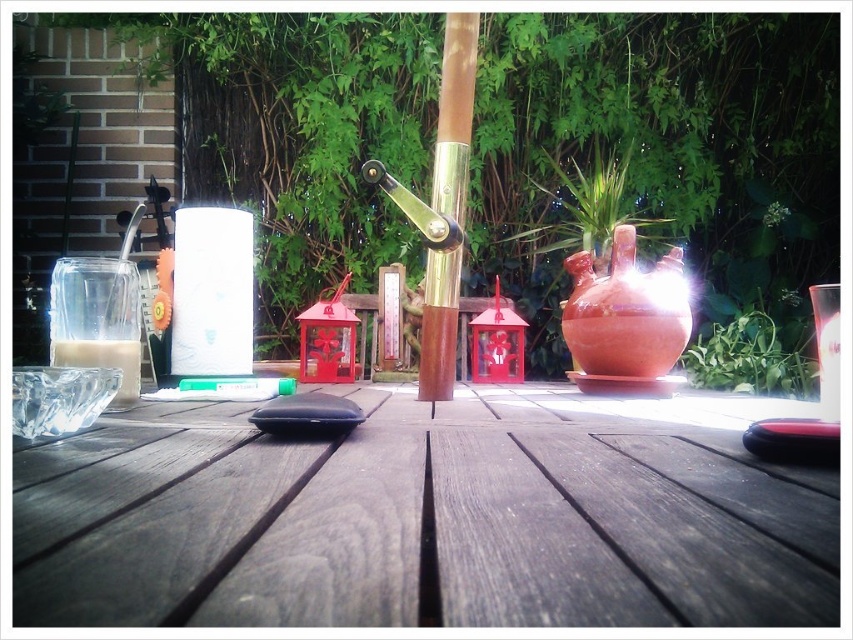
Is point (740, 195) behind point (729, 353)?

Yes.

Between matte terracotta pot at center and green leafy plant at lower right, which one is positioned higher?

matte terracotta pot at center is above.

Is point (697, 120) positioned in front of point (757, 326)?

No, (697, 120) is further to viewer.

Where is `matte terracotta pot at center`? Image resolution: width=853 pixels, height=640 pixels. matte terracotta pot at center is located at coordinates (657, 154).

Is dark wood table at center below green leafy plant at lower right?

Indeed, dark wood table at center is positioned under green leafy plant at lower right.

Between dark wood table at center and green leafy plant at lower right, which one is positioned higher?

green leafy plant at lower right is above.

Which is behind, point (413, 467) or point (811, 396)?

The point (811, 396) is more distant.

The height and width of the screenshot is (640, 853). I want to click on dark wood table at center, so click(x=427, y=516).

This screenshot has width=853, height=640. I want to click on dark wood table at center, so click(x=427, y=516).

Can you confirm if dark wood table at center is smaller than matte terracotta pot at center?

Yes, dark wood table at center is smaller than matte terracotta pot at center.

This screenshot has height=640, width=853. What do you see at coordinates (427, 516) in the screenshot?
I see `dark wood table at center` at bounding box center [427, 516].

Locate an element on the screen. dark wood table at center is located at coordinates (427, 516).